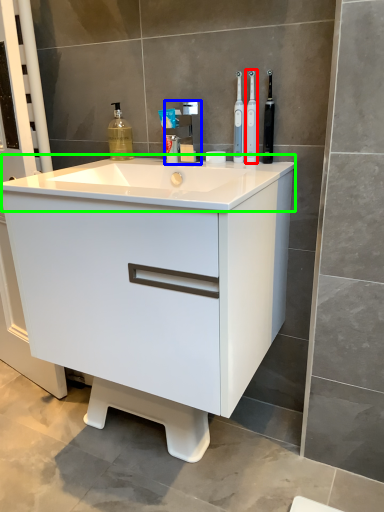
Question: Considering the real-world distances, which object is farthest from toothbrush (highlighted by a red box)? tap (highlighted by a blue box) or counter top (highlighted by a green box)?

Choices:
 (A) tap
 (B) counter top

Answer: (B)